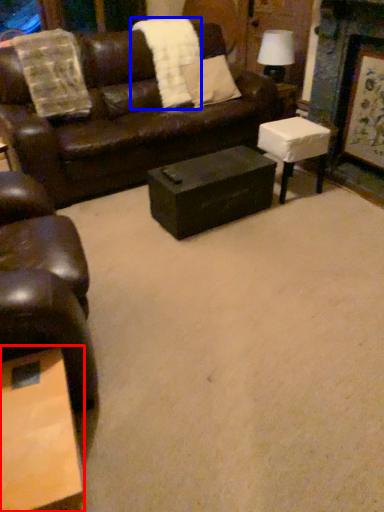
Question: Among these objects, which one is farthest to the camera, coffee table (highlighted by a red box) or blanket (highlighted by a blue box)?

Choices:
 (A) coffee table
 (B) blanket

Answer: (B)